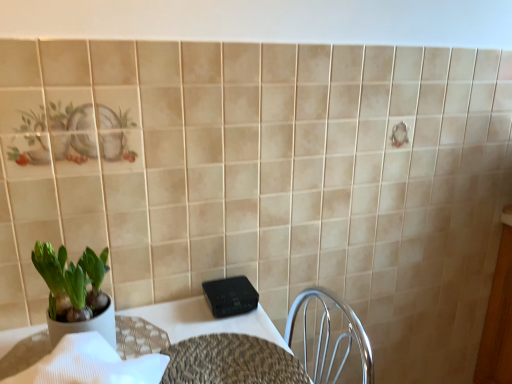
Question: From the image's perspective, is leopard print table at center above or below green matte pot at left?

Choices:
 (A) above
 (B) below

Answer: (B)

Question: In terms of size, does leopard print table at center appear bigger or smaller than green matte pot at left?

Choices:
 (A) big
 (B) small

Answer: (B)

Question: Estimate the real-world distances between objects in this image. Which object is closer to the green matte pot at left?

Choices:
 (A) leather textured table at lower left
 (B) leopard print table at center

Answer: (A)

Question: Which object is the farthest from the leopard print table at center?

Choices:
 (A) leather textured table at lower left
 (B) green matte pot at left

Answer: (B)